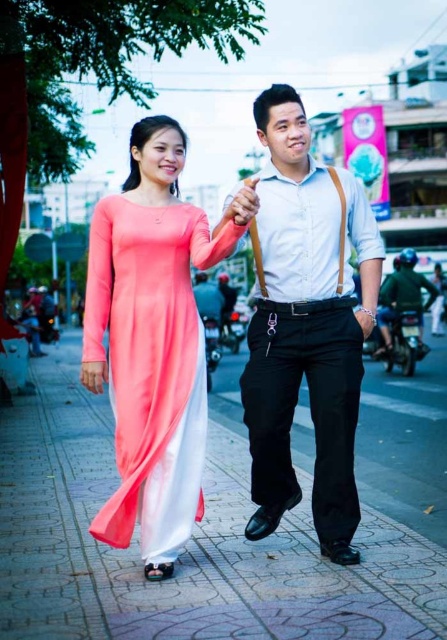
Between coral satin ao dai at center and matte black pants at center, which one has more height?

coral satin ao dai at center

Is coral satin ao dai at center to the left of matte black pants at center from the viewer's perspective?

Correct, you'll find coral satin ao dai at center to the left of matte black pants at center.

Does point (113, 317) lie in front of point (400, 307)?

Yes, point (113, 317) is closer to viewer.

What are the coordinates of `coral satin ao dai at center` in the screenshot? It's located at (151, 364).

Find the location of a particular element. matte white shirt at center is located at coordinates (306, 324).

In the scene shown: Measure the distance between matte white shirt at center and coral satin ao dai at center.

The distance of matte white shirt at center from coral satin ao dai at center is 29.87 inches.

Does point (273, 308) lie in front of point (231, 225)?

No, (273, 308) is behind (231, 225).

The width and height of the screenshot is (447, 640). Find the location of `matte white shirt at center`. matte white shirt at center is located at coordinates [306, 324].

Does matte white shirt at center have a greater height compared to matte black pants at center?

Indeed, matte white shirt at center has a greater height compared to matte black pants at center.

Is point (328, 477) positioned before point (391, 285)?

Yes, point (328, 477) is closer to viewer.

This screenshot has height=640, width=447. Find the location of `matte white shirt at center`. matte white shirt at center is located at coordinates (306, 324).

Where is `matte white shirt at center`? matte white shirt at center is located at coordinates (306, 324).